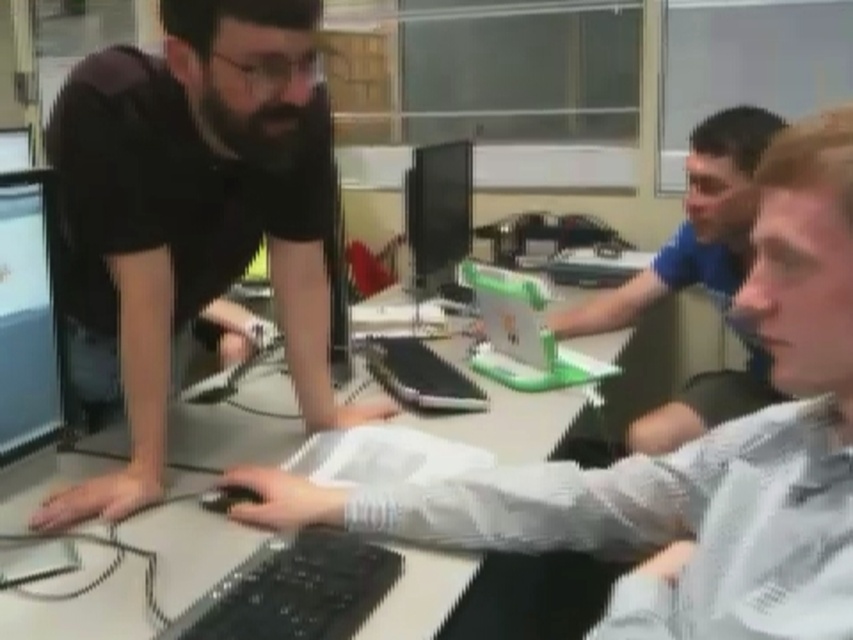
Question: Is white glossy keyboard at center behind black matte shirt at center?

Choices:
 (A) no
 (B) yes

Answer: (A)

Question: Which object is closer to the camera taking this photo?

Choices:
 (A) matte black monitor at center
 (B) black matte shirt at center
 (C) black plastic keyboard at lower center

Answer: (C)

Question: Does black matte shirt at center have a smaller size compared to white glossy table at center?

Choices:
 (A) yes
 (B) no

Answer: (B)

Question: Does white glossy keyboard at center lie in front of black matte shirt at center?

Choices:
 (A) yes
 (B) no

Answer: (A)

Question: Estimate the real-world distances between objects in this image. Which object is farther from the matte black monitor at center?

Choices:
 (A) black matte shirt at center
 (B) black plastic keyboard at lower center
 (C) matte black monitor at left
 (D) white glossy table at center

Answer: (B)

Question: Which point is farther to the camera?

Choices:
 (A) (1, 502)
 (B) (439, 241)

Answer: (B)